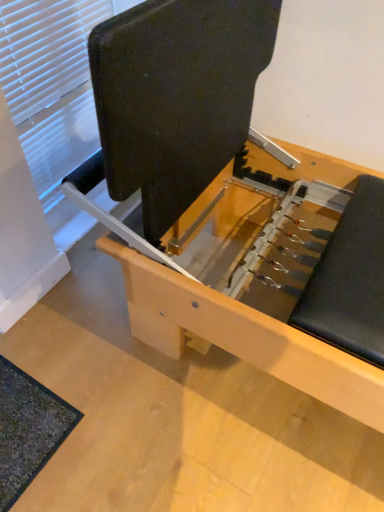
Question: Is matte black bench at center shorter than white matte window at upper left?

Choices:
 (A) yes
 (B) no

Answer: (A)

Question: From a real-world perspective, is matte black bench at center positioned over white matte window at upper left based on gravity?

Choices:
 (A) yes
 (B) no

Answer: (B)

Question: Are matte black bench at center and white matte window at upper left beside each other?

Choices:
 (A) no
 (B) yes

Answer: (A)

Question: Is matte black bench at center not close to white matte window at upper left?

Choices:
 (A) yes
 (B) no

Answer: (B)

Question: Can you confirm if matte black bench at center is positioned to the right of white matte window at upper left?

Choices:
 (A) yes
 (B) no

Answer: (A)

Question: Is white matte window at upper left taller or shorter than matte black bench at center?

Choices:
 (A) tall
 (B) short

Answer: (A)

Question: Is white matte window at upper left wider or thinner than matte black bench at center?

Choices:
 (A) thin
 (B) wide

Answer: (A)

Question: From a real-world perspective, is white matte window at upper left positioned above or below matte black bench at center?

Choices:
 (A) below
 (B) above

Answer: (B)

Question: Considering their positions, is white matte window at upper left located in front of or behind matte black bench at center?

Choices:
 (A) front
 (B) behind

Answer: (B)

Question: Is matte black bench at center to the left or to the right of white matte window at upper left in the image?

Choices:
 (A) left
 (B) right

Answer: (B)

Question: From the image's perspective, is matte black bench at center positioned above or below white matte window at upper left?

Choices:
 (A) above
 (B) below

Answer: (B)

Question: Is matte black bench at center taller or shorter than white matte window at upper left?

Choices:
 (A) short
 (B) tall

Answer: (A)

Question: Would you say matte black bench at center is inside or outside white matte window at upper left?

Choices:
 (A) inside
 (B) outside

Answer: (B)

Question: Looking at the image, does matte black bench at center seem bigger or smaller compared to dark green textured mat at lower left?

Choices:
 (A) small
 (B) big

Answer: (B)

Question: In terms of height, does matte black bench at center look taller or shorter compared to dark green textured mat at lower left?

Choices:
 (A) short
 (B) tall

Answer: (B)